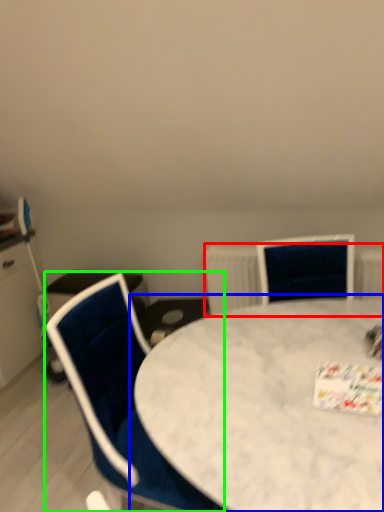
Question: Considering the real-world distances, which object is farthest from radiator (highlighted by a red box)? table (highlighted by a blue box) or chair (highlighted by a green box)?

Choices:
 (A) table
 (B) chair

Answer: (B)